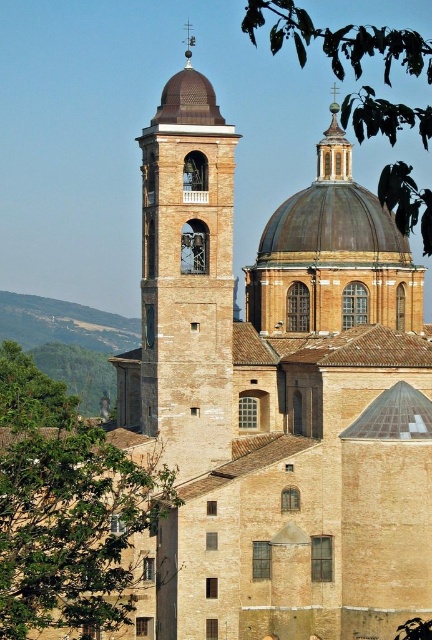
Is green leafy tree at left to the right of green leafy tree at upper center from the viewer's perspective?

In fact, green leafy tree at left is to the left of green leafy tree at upper center.

Is the position of green leafy tree at left more distant than that of green leafy tree at upper center?

Yes, green leafy tree at left is further from the viewer.

Is point (123, 538) closer to camera compared to point (361, 109)?

No, it is not.

The height and width of the screenshot is (640, 432). I want to click on green leafy tree at left, so click(x=66, y=509).

Which is behind, point (29, 544) or point (222, 349)?

The point (222, 349) is more distant.

Which is below, green leafy tree at left or beige stone bell tower at center?

Positioned lower is green leafy tree at left.

Locate an element on the screen. Image resolution: width=432 pixels, height=640 pixels. green leafy tree at left is located at coordinates (66, 509).

Does beige stone bell tower at center appear over green leafy tree at upper center?

Actually, beige stone bell tower at center is below green leafy tree at upper center.

Which is more to the right, beige stone bell tower at center or green leafy tree at upper center?

green leafy tree at upper center

Does point (216, 426) come closer to viewer compared to point (365, 92)?

Yes, it is.

What are the coordinates of `beige stone bell tower at center` in the screenshot? It's located at (187, 275).